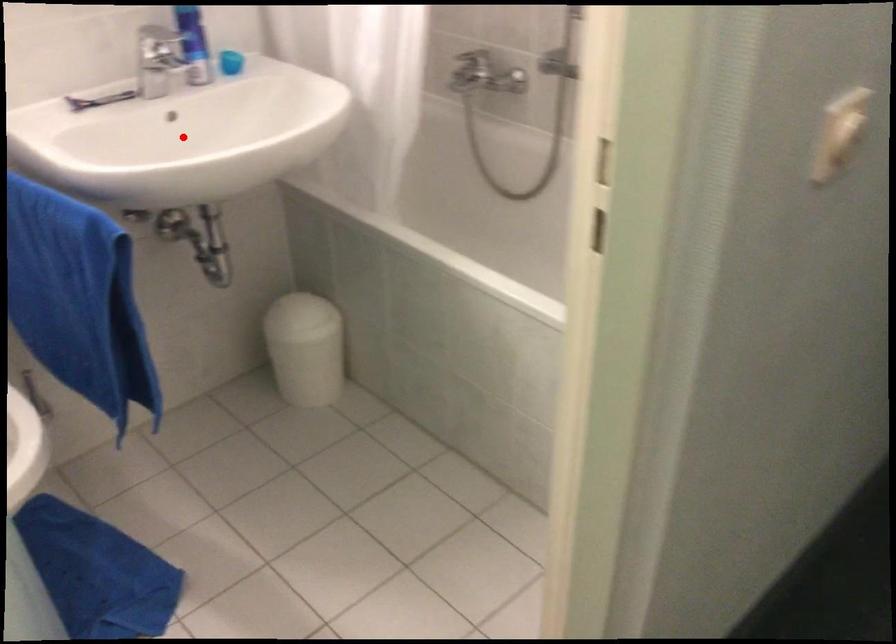
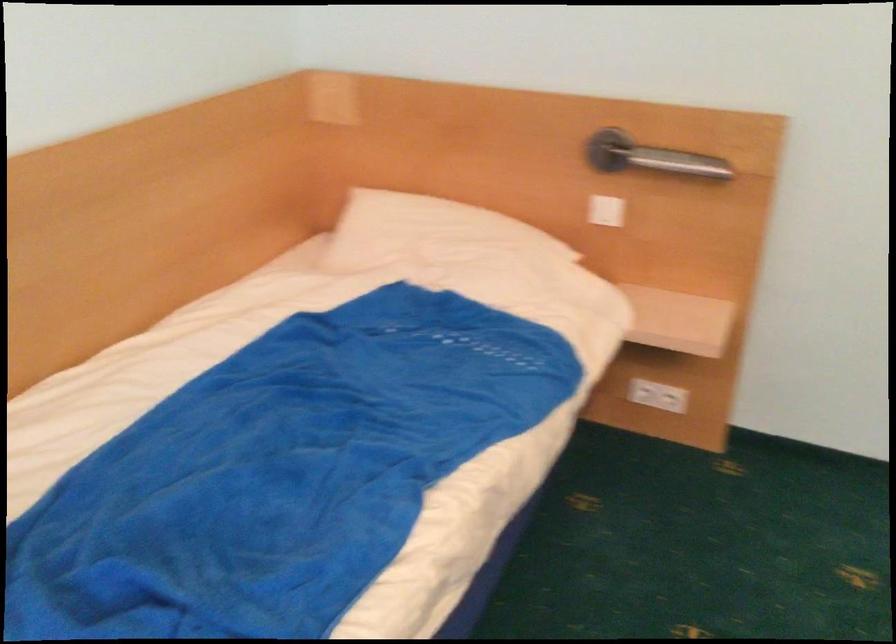
Question: I am providing you with two images of the same scene from different viewpoints. A red point is marked on the first image. Can you still see the location of the red point in image 2?

Choices:
 (A) Yes
 (B) No

Answer: (B)